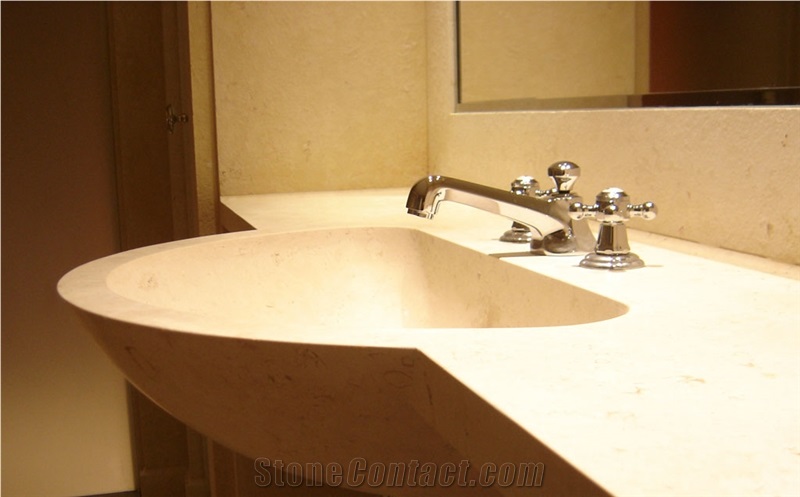
In order to click on tap handles in this screenshot , I will do `click(522, 182)`, `click(617, 200)`.